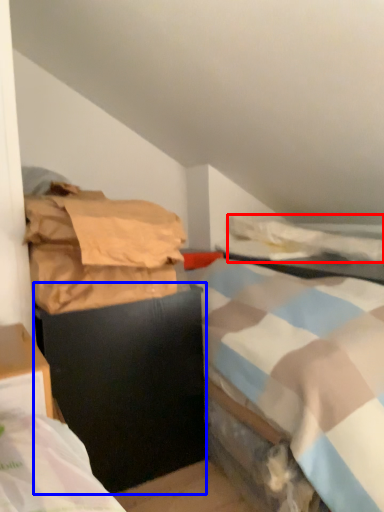
Question: Which of the following is the closest to the observer, blanket (highlighted by a red box) or furniture (highlighted by a blue box)?

Choices:
 (A) blanket
 (B) furniture

Answer: (B)